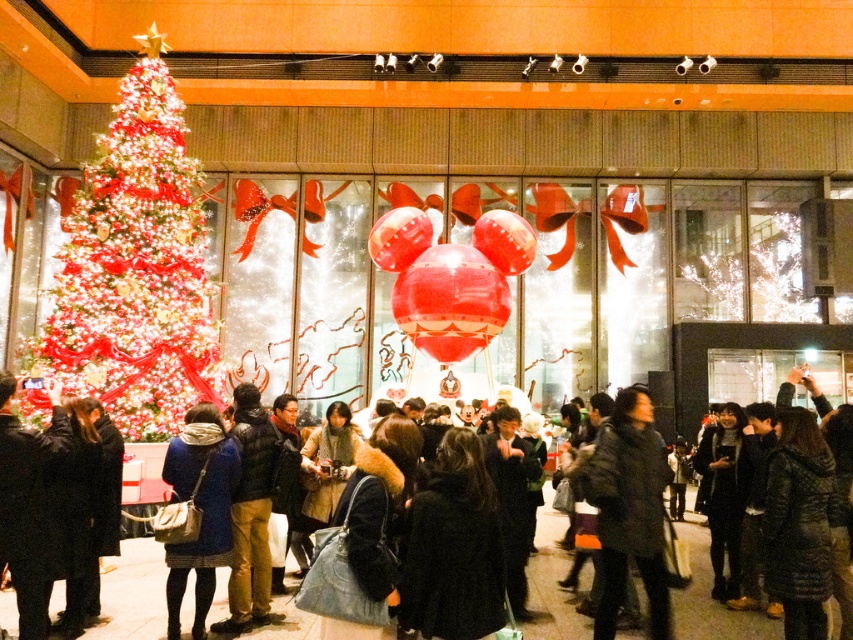
You are standing in the festive scene and want to pick up a coat. Which black coat is easier to reach without moving your position? The black fuzzy coat at center or the black wool coat at lower left?

The black wool coat at lower left is easier to reach because it is positioned lower than the black fuzzy coat at center, which is above it.

You are standing in the festive scene and notice two coats hanging from the ceiling. Which coat is positioned lower between the black wool coat at center and the black fuzzy coat at center?

The black wool coat at center is located below the black fuzzy coat at center, so it is positioned lower.